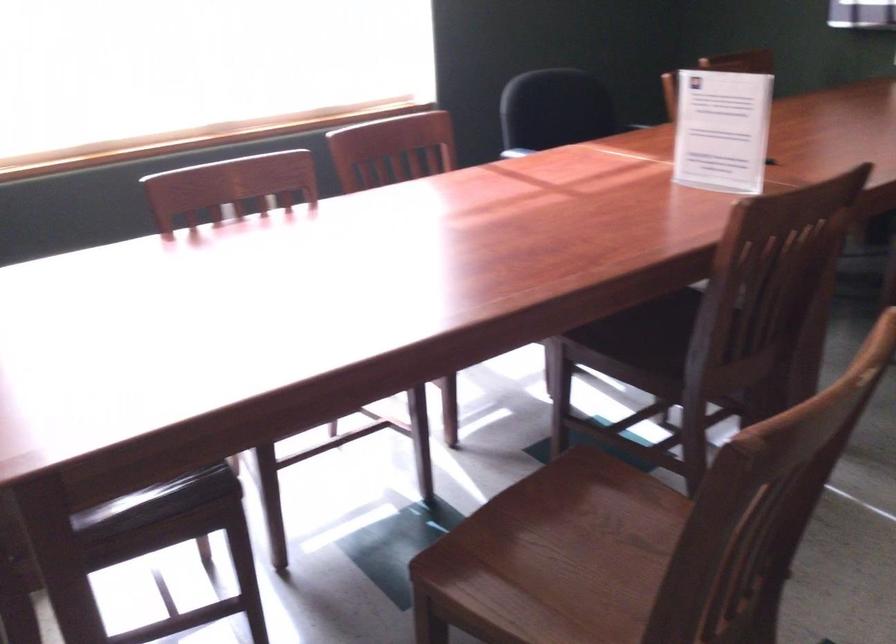
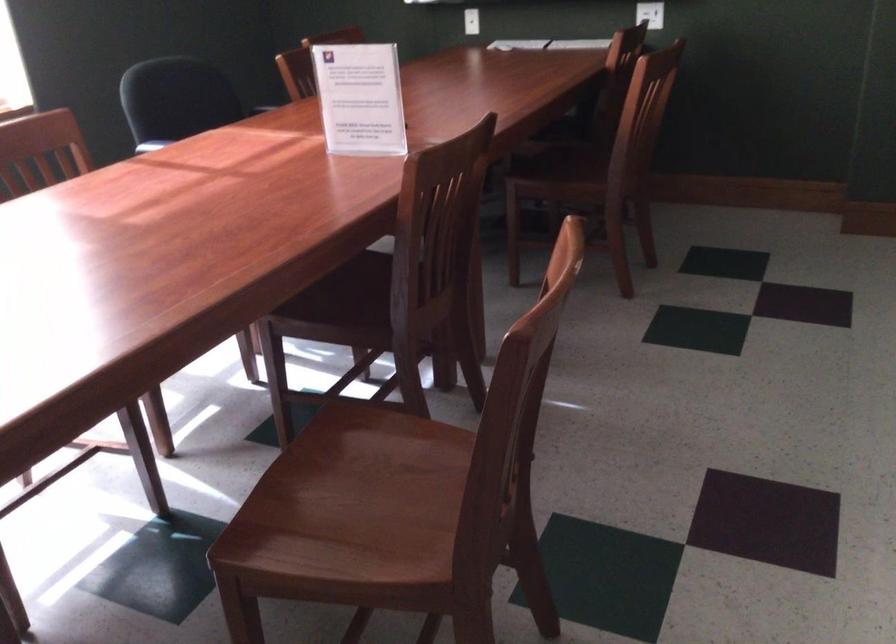
In the second image, find the point that corresponds to point (564, 561) in the first image.

(351, 504)